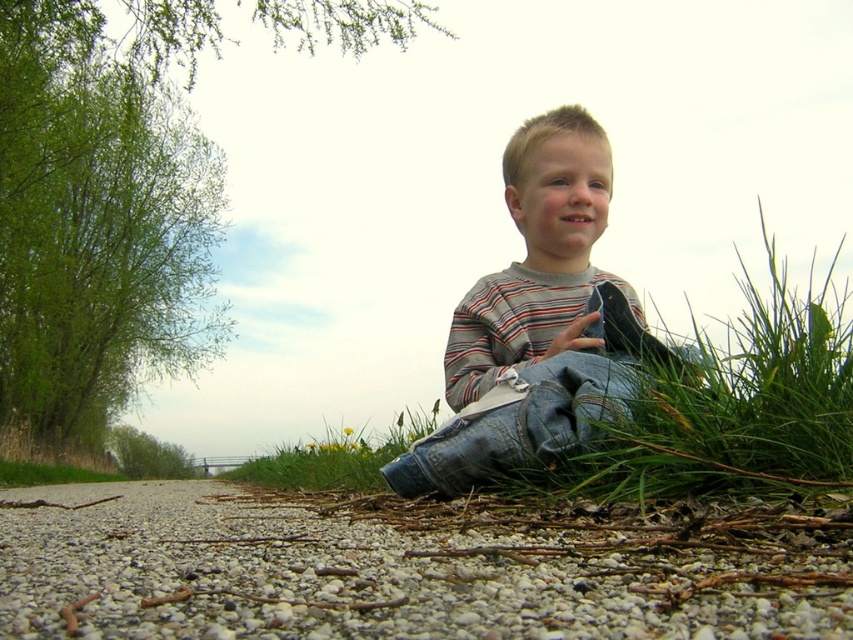
You are a photographer trying to capture the child in the image. You want to position yourself at point A and point B to take two different shots. Given that point A is point [477,326] and point B is point [372,461], which point should you stand closer to the child to get a better closeup?

Point A at [477,326] is in front of point B at [372,461], so standing at point A would place you closer to the child for a better closeup.

You are a photographer standing at the camera position. You want to place a small 10 inch wide decoration on the ground such that it is exactly halfway between the camera and the gray gravel at lower center. Where should you place the decoration?

The gray gravel at lower center is 30.19 inches from the camera. To place the decoration halfway, it should be placed at 15.095 inches from the camera towards the gray gravel at lower center.